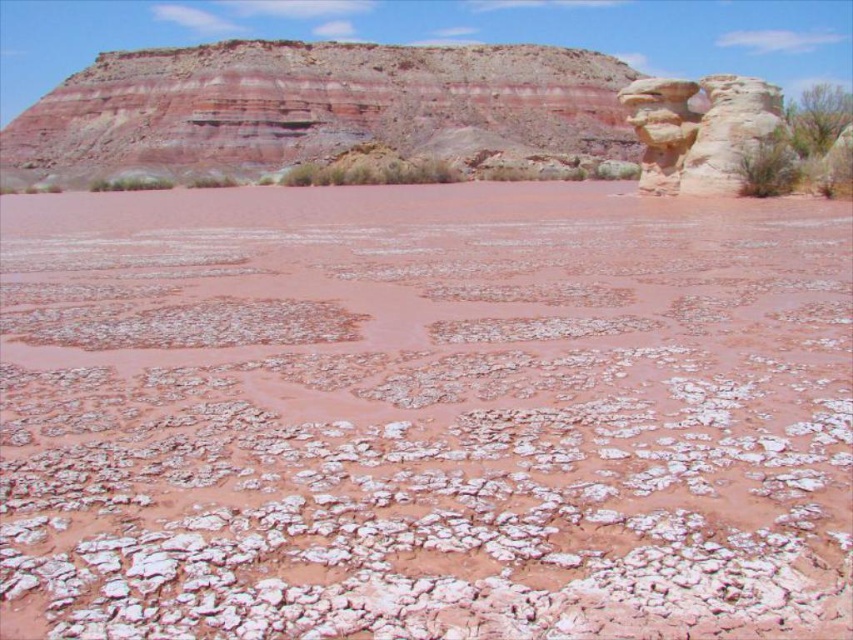
Which is above, dried mud at center or smooth sandstone rock formation at upper right?

Positioned higher is smooth sandstone rock formation at upper right.

In order to click on dried mud at center in this screenshot , I will do `click(422, 413)`.

Identify the location of dried mud at center. This screenshot has height=640, width=853. (422, 413).